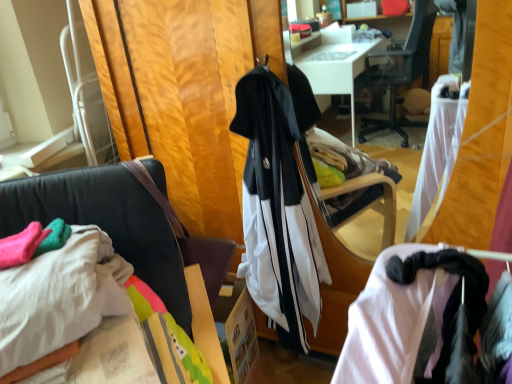
Question: Considering the positions of white cotton sheet at lower left and velvet black chair at center in the image, is white cotton sheet at lower left taller or shorter than velvet black chair at center?

Choices:
 (A) short
 (B) tall

Answer: (A)

Question: Visually, is white cotton sheet at lower left positioned to the left or to the right of velvet black chair at center?

Choices:
 (A) right
 (B) left

Answer: (B)

Question: Considering the real-world distances, which object is closest to the velvet black chair at center?

Choices:
 (A) white cotton sheet at lower left
 (B) white matte tracksuit at center

Answer: (A)

Question: Considering the real-world distances, which object is closest to the velvet black chair at center?

Choices:
 (A) white matte tracksuit at center
 (B) white cotton sheet at lower left

Answer: (B)